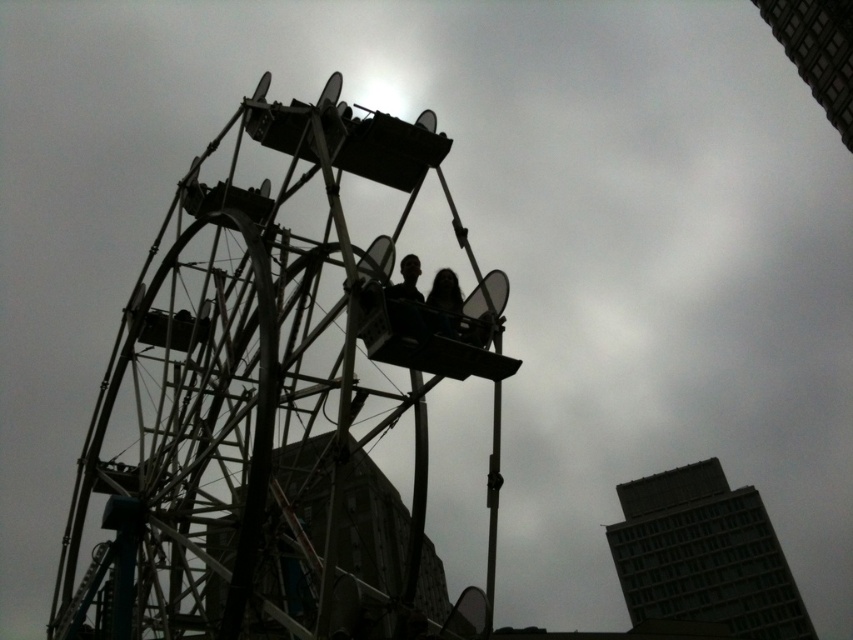
Question: Estimate the real-world distances between objects in this image. Which object is closer to the silhouette fabric at center?

Choices:
 (A) dark hair at center
 (B) gray concrete building at center
 (C) metallic ferris wheel at center

Answer: (A)

Question: Does silhouette fabric at center have a smaller size compared to dark hair at center?

Choices:
 (A) yes
 (B) no

Answer: (B)

Question: Is metallic ferris wheel at center above dark hair at center?

Choices:
 (A) yes
 (B) no

Answer: (B)

Question: Which point is farther to the camera?

Choices:
 (A) metallic ferris wheel at center
 (B) silhouette fabric at center

Answer: (B)

Question: Is metallic ferris wheel at center further to camera compared to gray concrete building at center?

Choices:
 (A) yes
 (B) no

Answer: (B)

Question: Which point is closer to the camera?

Choices:
 (A) silhouette fabric at center
 (B) dark hair at center
 (C) gray concrete building at center
 (D) metallic ferris wheel at center

Answer: (D)